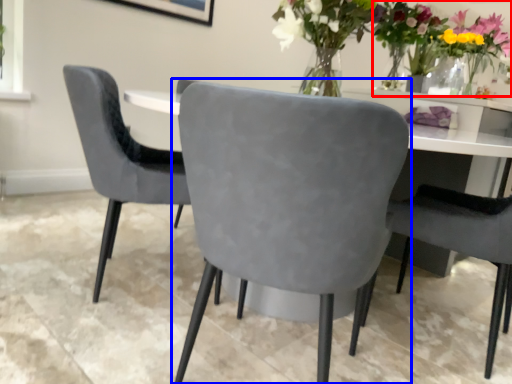
Question: Which point is closer to the camera, floral arrangement (highlighted by a red box) or chair (highlighted by a blue box)?

Choices:
 (A) floral arrangement
 (B) chair

Answer: (B)